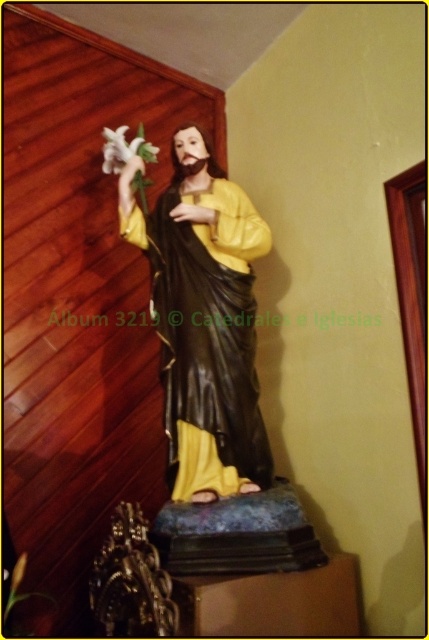
Can you confirm if matte yellow fabric at center is thinner than white matte lily at upper left?

No, matte yellow fabric at center is not thinner than white matte lily at upper left.

Can you confirm if matte yellow fabric at center is positioned to the right of white matte lily at upper left?

Indeed, matte yellow fabric at center is positioned on the right side of white matte lily at upper left.

Which is behind, point (226, 324) or point (117, 148)?

The point (117, 148) is behind.

In order to click on matte yellow fabric at center in this screenshot , I will do `click(207, 337)`.